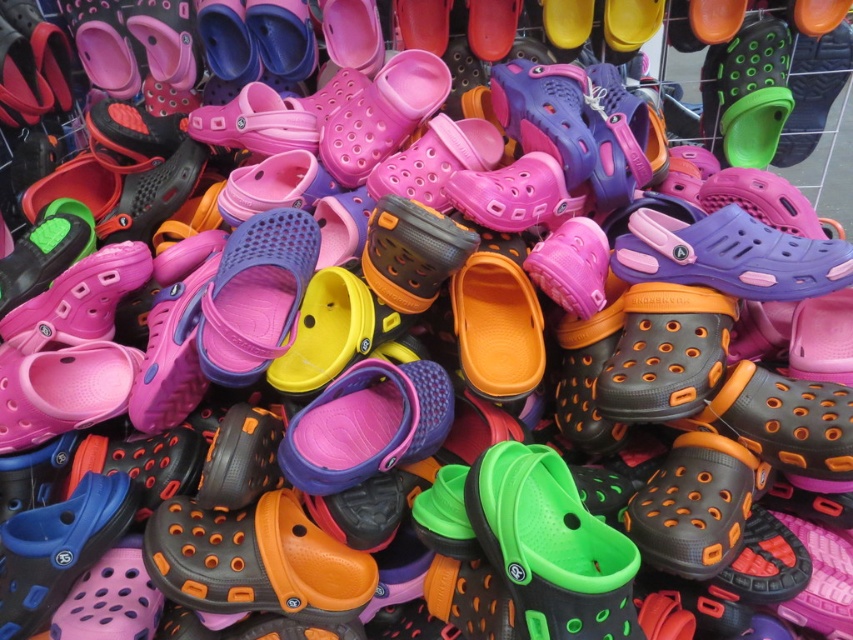
Between green rubber clog at center and orange matte clog at center, which one has less height?

orange matte clog at center is shorter.

Who is lower down, green rubber clog at center or orange matte clog at center?

Positioned lower is orange matte clog at center.

Where is `green rubber clog at center`? green rubber clog at center is located at coordinates click(550, 547).

The width and height of the screenshot is (853, 640). I want to click on green rubber clog at center, so click(550, 547).